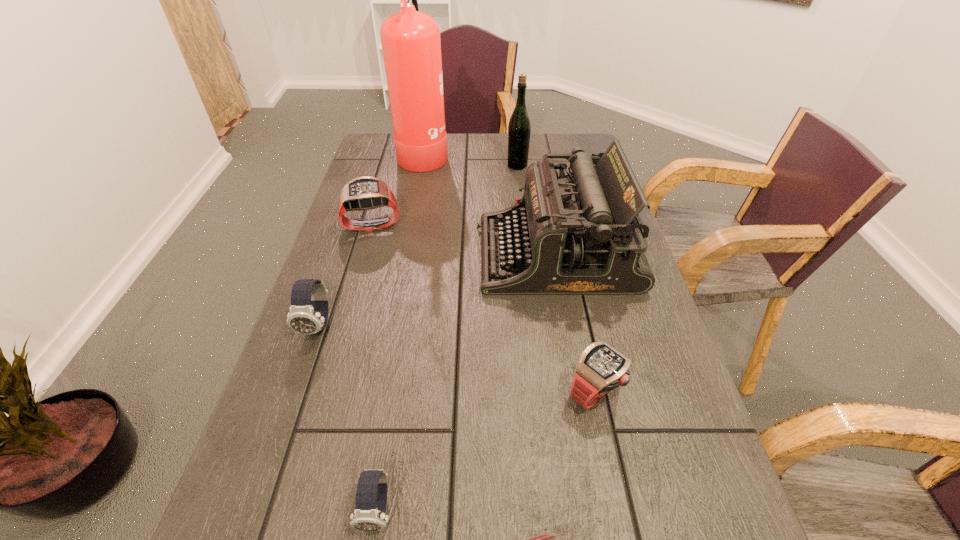
Select which watch is the closest to the typewriter. Please provide its 2D coordinates. Your answer should be formatted as a tuple, i.e. [(x, y)], where the tuple contains the x and y coordinates of a point satisfying the conditions above.

[(601, 368)]

This screenshot has width=960, height=540. Find the location of `watch that is the second closest to the second nearest red watch`. watch that is the second closest to the second nearest red watch is located at coordinates (371, 495).

Where is `red watch that is the second closest to the nearest red watch`? The width and height of the screenshot is (960, 540). red watch that is the second closest to the nearest red watch is located at coordinates (363, 193).

Select which red watch appears as the second closest to the biggest red watch. Please provide its 2D coordinates. Your answer should be formatted as a tuple, i.e. [(x, y)], where the tuple contains the x and y coordinates of a point satisfying the conditions above.

[(546, 539)]

At what (x,y) coordinates should I click in order to perform the action: click on vacant point that satisfies the following two spatial constraints: 1. on the front side of the farthest red watch; 2. on the left side of the rightmost red watch. Please return your answer as a coordinate pair (x, y). This screenshot has width=960, height=540. Looking at the image, I should click on (324, 392).

The width and height of the screenshot is (960, 540). In order to click on free spot that satisfies the following two spatial constraints: 1. towards the nozzle of the tallest object; 2. on the left side of the green beer bottle in this screenshot , I will do `click(421, 165)`.